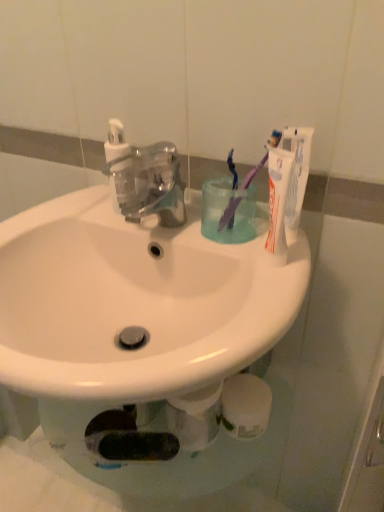
Question: Based on their positions, is transparent plastic faucet at center located to the left or right of white glossy sink at center?

Choices:
 (A) left
 (B) right

Answer: (B)

Question: Is transparent plastic faucet at center in front of or behind white glossy sink at center in the image?

Choices:
 (A) front
 (B) behind

Answer: (B)

Question: Estimate the real-world distances between objects in this image. Which object is closer to the transparent plastic faucet at center?

Choices:
 (A) transparent plastic soap dispenser at upper left
 (B) white matte toothpaste at upper right
 (C) translucent plastic cup at center
 (D) purple plastic toothbrush at upper right, the 1th toothbrush when ordered from left to right
 (E) purple plastic toothbrush at upper right, which is the 2th toothbrush from left to right

Answer: (A)

Question: Estimate the real-world distances between objects in this image. Which object is closer to the white matte toothpaste at upper right?

Choices:
 (A) transparent plastic faucet at center
 (B) transparent plastic soap dispenser at upper left
 (C) translucent plastic cup at center
 (D) purple plastic toothbrush at upper right, the 1th toothbrush in the right-to-left sequence
 (E) white glossy sink at center

Answer: (D)